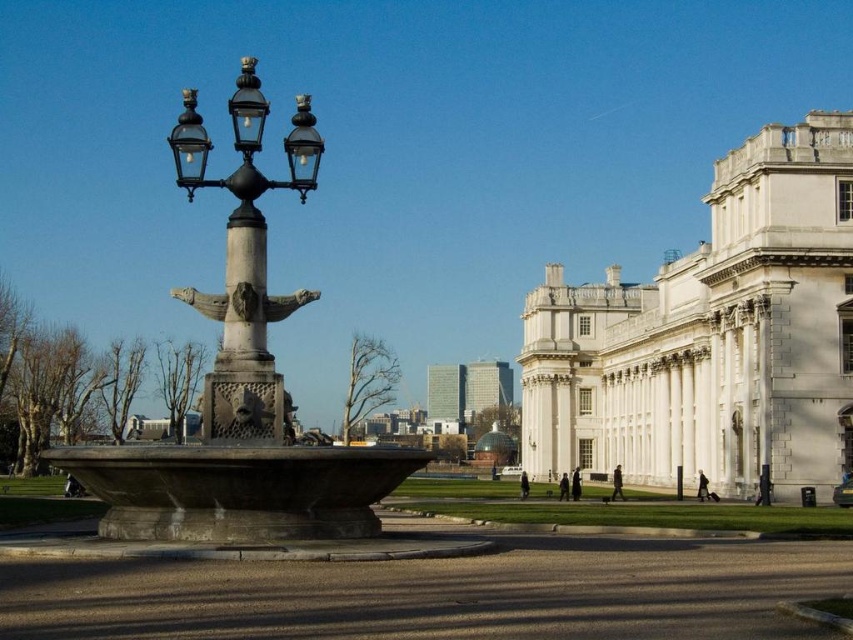
Question: Which point appears closest to the camera in this image?

Choices:
 (A) (822, 280)
 (B) (113, 502)

Answer: (B)

Question: Which point is farther from the camera taking this photo?

Choices:
 (A) (312, 140)
 (B) (726, 276)

Answer: (B)

Question: Which object is farther from the camera taking this photo?

Choices:
 (A) matte black street light at center left
 (B) white stone building at center-right

Answer: (B)

Question: Does white stone building at center-right have a lesser width compared to stone fountain at center?

Choices:
 (A) yes
 (B) no

Answer: (A)

Question: Can you confirm if stone fountain at center is positioned to the left of matte black street light at center left?

Choices:
 (A) no
 (B) yes

Answer: (B)

Question: In this image, where is stone fountain at center located relative to matte black street light at center left?

Choices:
 (A) below
 (B) above

Answer: (A)